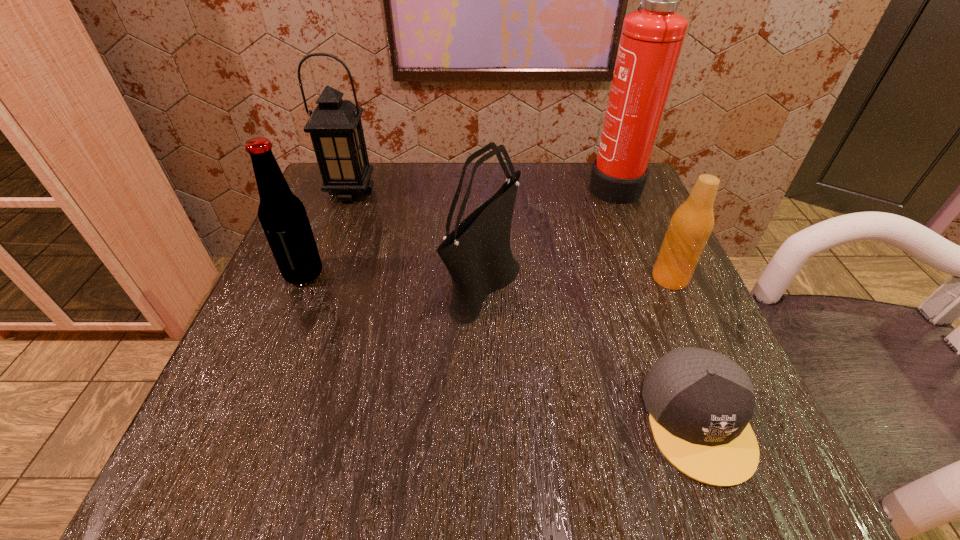
Where is `fire extinguisher present at the right edge`? fire extinguisher present at the right edge is located at coordinates (651, 39).

Where is `beer bottle located in the right edge section of the desktop`? This screenshot has height=540, width=960. beer bottle located in the right edge section of the desktop is located at coordinates (691, 225).

This screenshot has height=540, width=960. I want to click on cap present at the right edge, so click(x=700, y=402).

Where is `object situated at the far left corner`? object situated at the far left corner is located at coordinates (335, 127).

Identify the location of object situated at the far right corner. Image resolution: width=960 pixels, height=540 pixels. (651, 39).

Where is `object positioned at the near right corner`? object positioned at the near right corner is located at coordinates (700, 402).

Image resolution: width=960 pixels, height=540 pixels. What are the coordinates of `vacant space at the far edge of the desktop` in the screenshot? It's located at (493, 164).

The height and width of the screenshot is (540, 960). Identify the location of free spot at the near edge of the desktop. (634, 474).

At what (x,y) coordinates should I click in order to perform the action: click on free region at the left edge of the desktop. Please return your answer as a coordinate pair (x, y). Looking at the image, I should click on (344, 307).

Locate an element on the screen. This screenshot has height=540, width=960. vacant area at the right edge of the desktop is located at coordinates (636, 366).